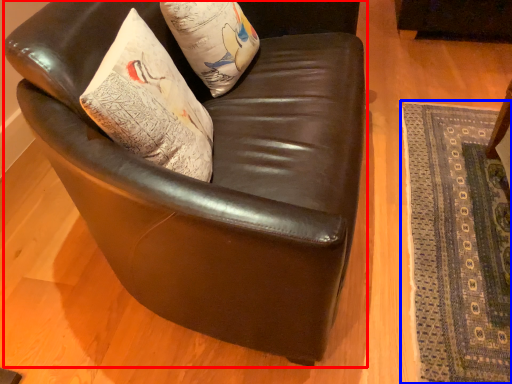
Question: Among these objects, which one is nearest to the camera, chair (highlighted by a red box) or mat (highlighted by a blue box)?

Choices:
 (A) chair
 (B) mat

Answer: (A)